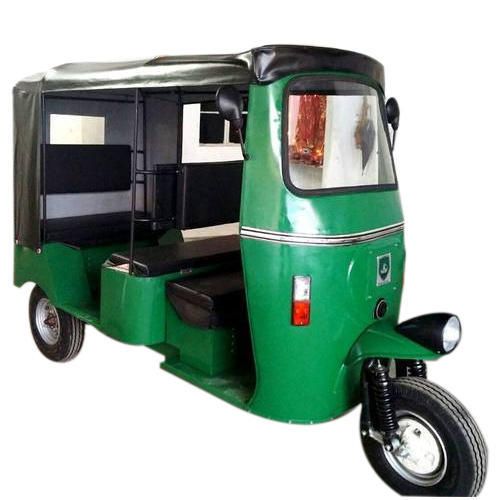
You are a GUI agent. You are given a task and a screenshot of the screen. Output one action in this format:
    pyautogui.click(x=<x>, y=<y>)
    Task: Click on the seat backs
    
    Given the screenshot: What is the action you would take?
    pyautogui.click(x=188, y=191), pyautogui.click(x=103, y=172)